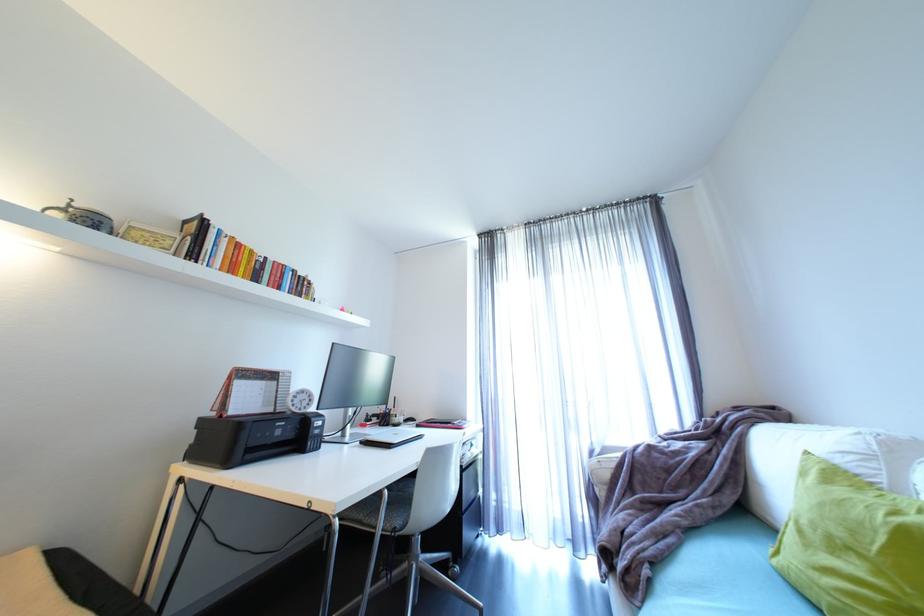
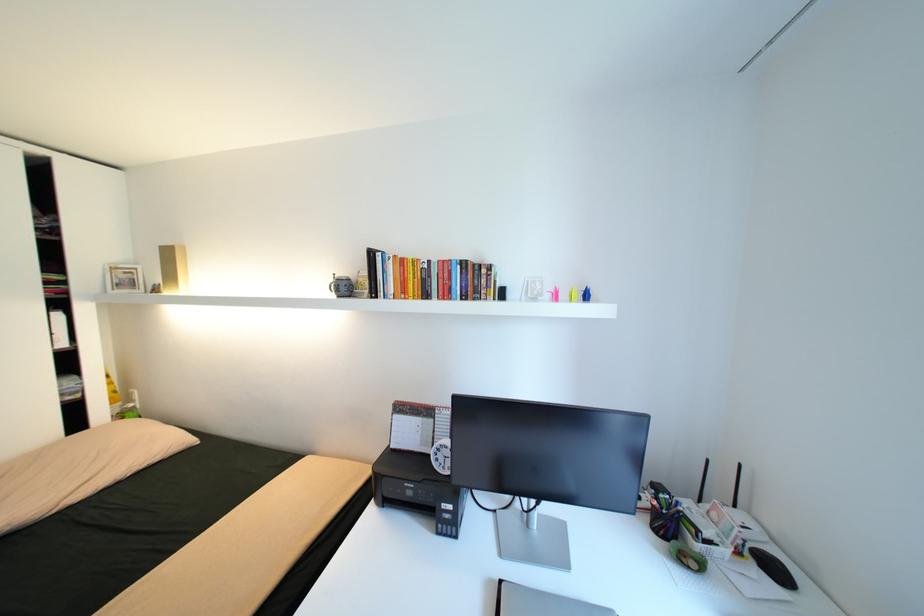
Locate, in the second image, the point that corresponds to pixel 287 374 in the first image.

(444, 411)